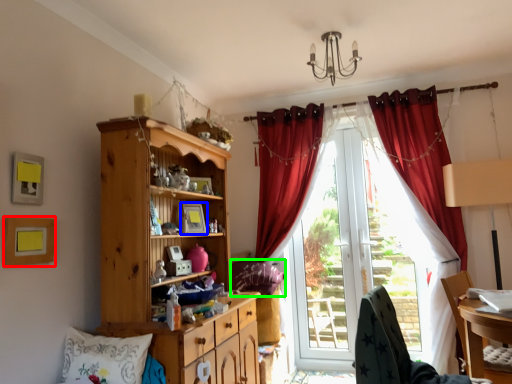
Question: Based on their relative distances, which object is nearer to picture frame (highlighted by a red box)? Choose from picture frame (highlighted by a blue box) and pillow (highlighted by a green box).

Choices:
 (A) picture frame
 (B) pillow

Answer: (A)